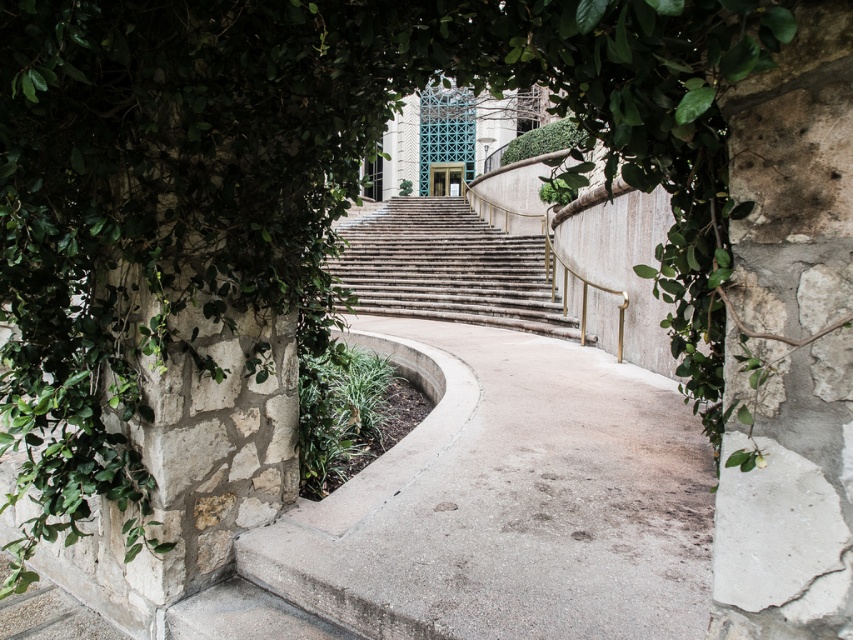
Who is positioned more to the left, gray concrete path at lower center or stone textured stairs at center?

From the viewer's perspective, stone textured stairs at center appears more on the left side.

This screenshot has height=640, width=853. I want to click on gray concrete path at lower center, so click(509, 502).